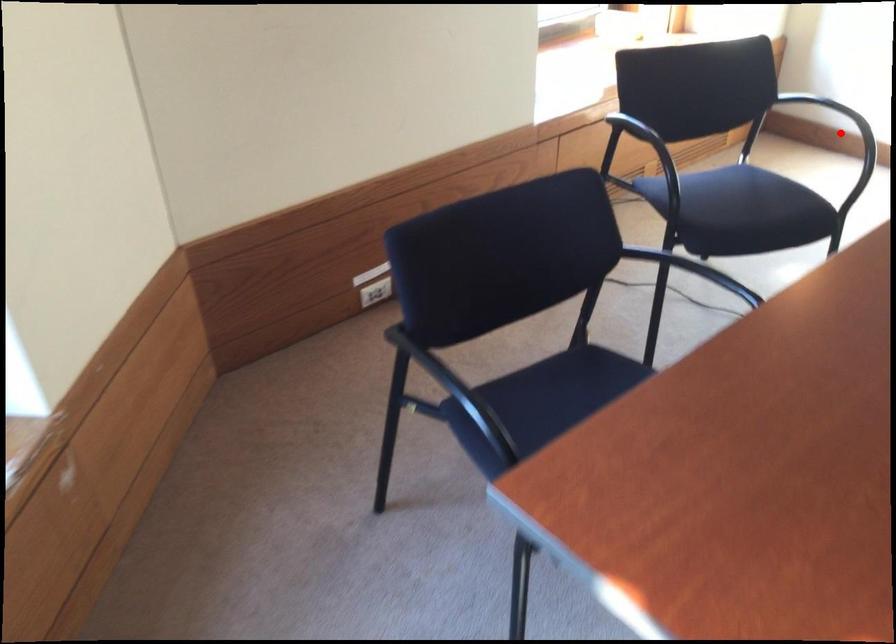
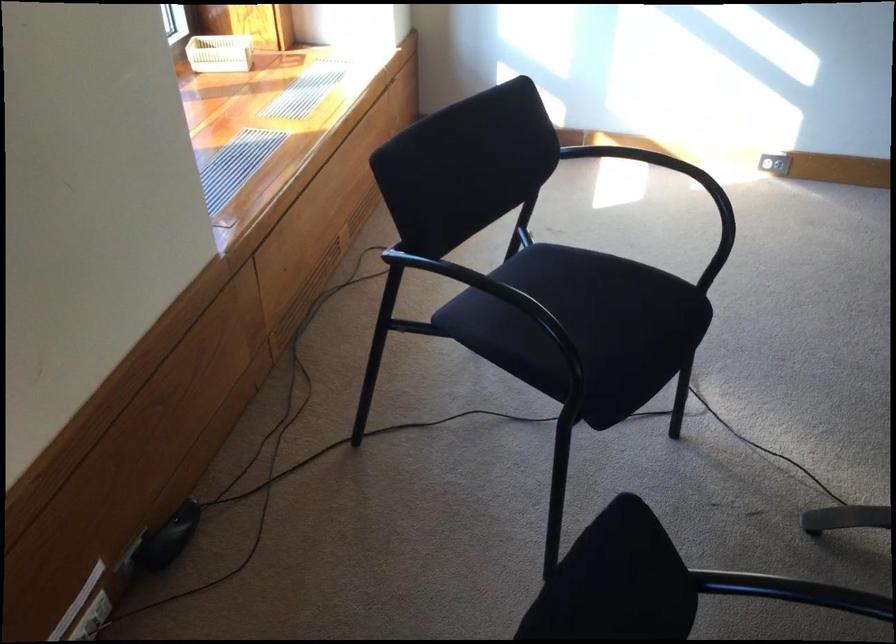
Question: I am providing you with two images of the same scene from different viewpoints. A red point is marked on the first image. Can you still see the location of the red point in image 2?

Choices:
 (A) Yes
 (B) No

Answer: (B)